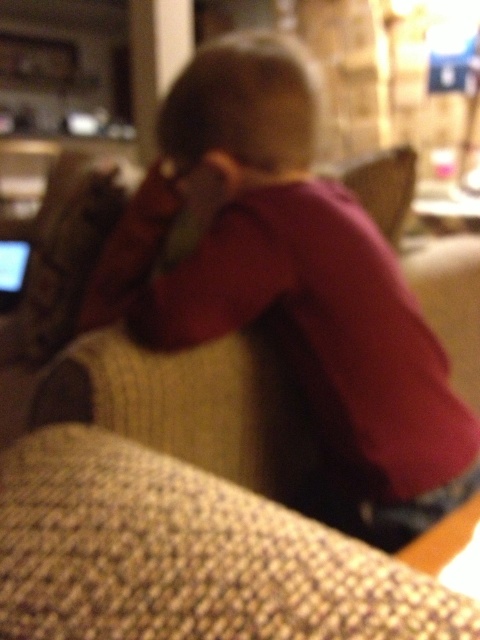
Question: Does pink fabric shirt at center have a greater width compared to knitted beige couch at center?

Choices:
 (A) no
 (B) yes

Answer: (B)

Question: Is knitted beige couch at center to the left of matte black laptop at left from the viewer's perspective?

Choices:
 (A) yes
 (B) no

Answer: (B)

Question: Which point appears closest to the camera in this image?

Choices:
 (A) (14, 291)
 (B) (290, 525)
 (C) (248, 234)

Answer: (B)

Question: Estimate the real-world distances between objects in this image. Which object is farther from the knitted beige couch at center?

Choices:
 (A) pink fabric shirt at center
 (B) matte black laptop at left

Answer: (B)

Question: Among these points, which one is nearest to the camera?

Choices:
 (A) (67, 484)
 (B) (14, 294)

Answer: (A)

Question: Does pink fabric shirt at center appear on the left side of matte black laptop at left?

Choices:
 (A) no
 (B) yes

Answer: (A)